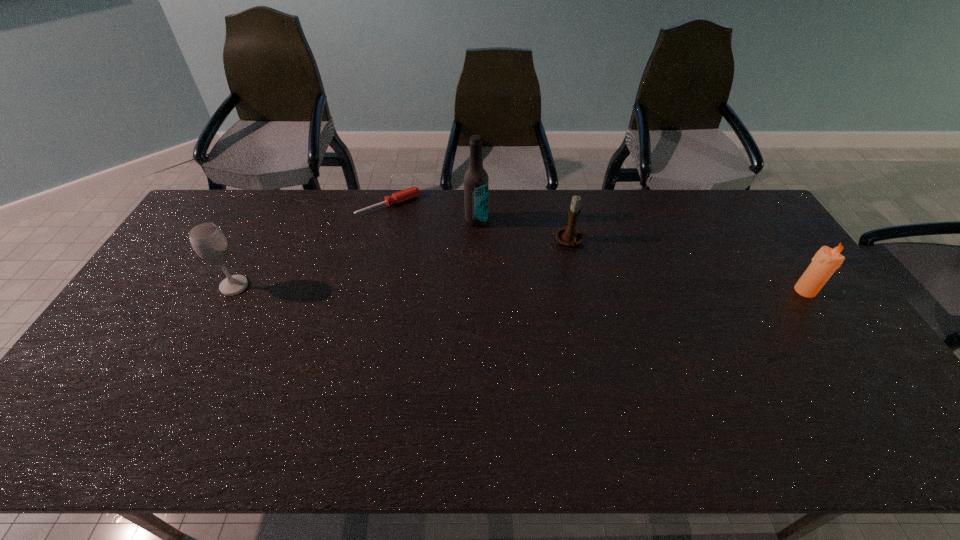
At what (x,y) coordinates should I click in order to perform the action: click on free space between the rightmost object and the shortest object. Please return your answer as a coordinate pair (x, y). This screenshot has width=960, height=540. Looking at the image, I should click on (596, 248).

Find the location of a particular element. vacant area between the fourth object from right to left and the third object from left to right is located at coordinates (432, 213).

You are a GUI agent. You are given a task and a screenshot of the screen. Output one action in this format:
    pyautogui.click(x=<x>, y=<y>)
    Task: Click on the free space between the rightmost object and the second object from left to right
    The height and width of the screenshot is (540, 960).
    Given the screenshot: What is the action you would take?
    pyautogui.click(x=596, y=248)

Locate an element on the screen. The width and height of the screenshot is (960, 540). blank region between the shortest object and the candle is located at coordinates pos(596,248).

You are a GUI agent. You are given a task and a screenshot of the screen. Output one action in this format:
    pyautogui.click(x=<x>, y=<y>)
    Task: Click on the free spot between the rightmost object and the third nearest object
    This screenshot has width=960, height=540.
    Given the screenshot: What is the action you would take?
    pyautogui.click(x=687, y=266)

Identify the location of empty space between the tallest object and the screwdriver. (432, 213).

Where is `vacant area that lies between the wineglass and the third farthest object`? The image size is (960, 540). vacant area that lies between the wineglass and the third farthest object is located at coordinates (402, 264).

Where is `free space between the third object from right to left and the candle`? The image size is (960, 540). free space between the third object from right to left and the candle is located at coordinates (640, 255).

Locate an element on the screen. Image resolution: width=960 pixels, height=540 pixels. object that is the third closest to the third object from right to left is located at coordinates (208, 241).

Identify which object is located as the nearest to the shortest object. Please provide its 2D coordinates. Your answer should be formatted as a tuple, i.e. [(x, y)], where the tuple contains the x and y coordinates of a point satisfying the conditions above.

[(476, 180)]